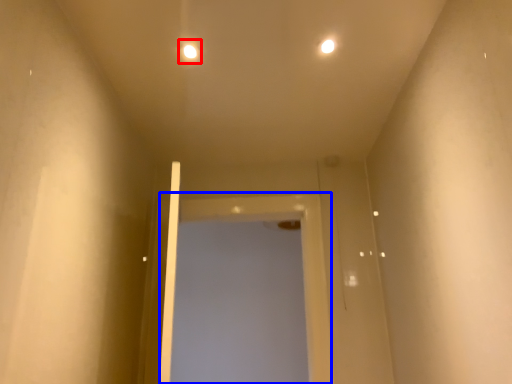
Question: Which object is closer to the camera taking this photo, light (highlighted by a red box) or screen door (highlighted by a blue box)?

Choices:
 (A) light
 (B) screen door

Answer: (A)